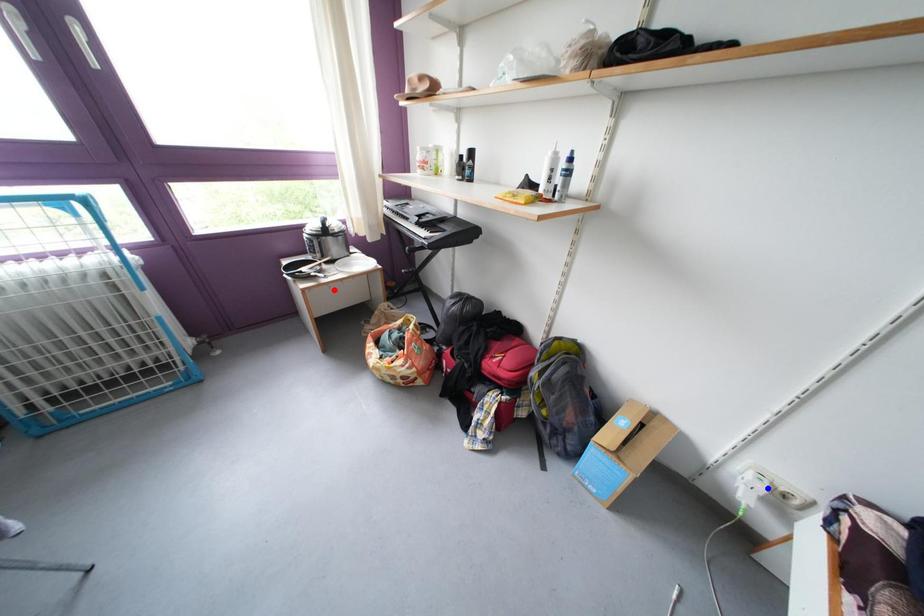
Question: In the image, two points are highlighted. Which point is nearer to the camera? Reply with the corresponding letter.

Choices:
 (A) blue point
 (B) red point

Answer: (A)